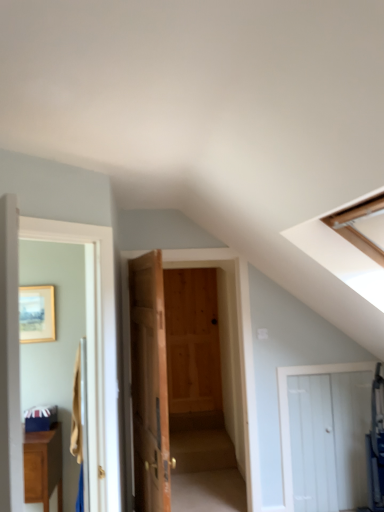
Question: Is point (97, 428) positioned closer to the camera than point (180, 250)?

Choices:
 (A) closer
 (B) farther

Answer: (A)

Question: Visually, is white wooden door at left, the 4th door positioned from the right, positioned to the left or to the right of natural wood door at center, arranged as the 3th door when viewed from the left?

Choices:
 (A) left
 (B) right

Answer: (A)

Question: Which object is the farthest from the matte brown cabinet at lower left?

Choices:
 (A) wooden picture frame at upper left
 (B) white wooden door at left, the 4th door positioned from the right
 (C) wooden door at center, which is the 3th door from right to left
 (D) natural wood door at center, which is the 2th door in right-to-left order
 (E) white wooden door at lower right, acting as the 1th door starting from the right

Answer: (E)

Question: Estimate the real-world distances between objects in this image. Which object is closer to the natural wood door at center, arranged as the 3th door when viewed from the left?

Choices:
 (A) wooden door at center, which is the 3th door from right to left
 (B) wooden picture frame at upper left
 (C) white wooden door at lower right, acting as the 1th door starting from the right
 (D) white wooden door at left, which appears as the 1th door when viewed from the left
 (E) matte brown cabinet at lower left

Answer: (A)